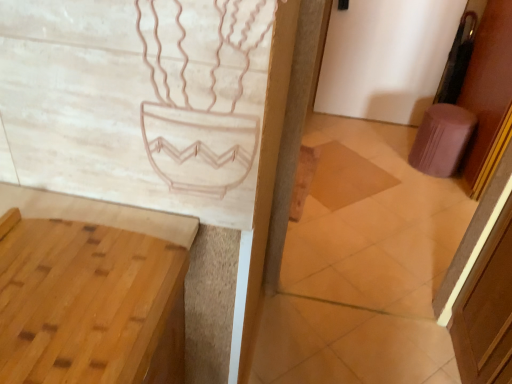
This screenshot has width=512, height=384. I want to click on empty space that is ontop of brown wooden tile at center (from a real-world perspective), so click(x=342, y=171).